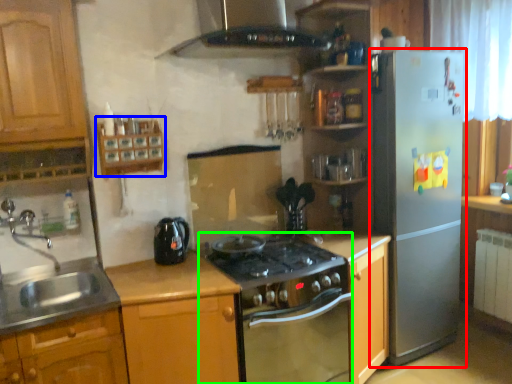
Question: Which object is positioned farthest from refrigerator (highlighted by a red box)? Select from shelf (highlighted by a blue box) and oven (highlighted by a green box).

Choices:
 (A) shelf
 (B) oven

Answer: (A)